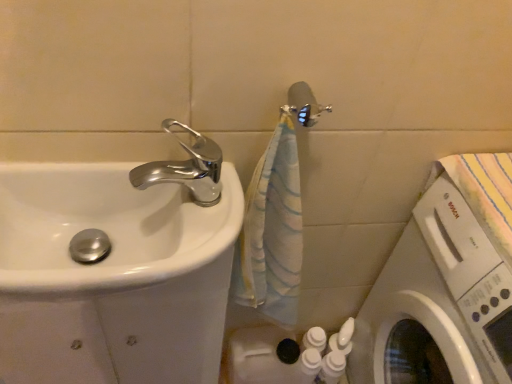
At what (x,y) coordinates should I click in order to perform the action: click on white glossy washing machine at lower right. Please return your answer as a coordinate pair (x, y). This screenshot has height=384, width=512. Looking at the image, I should click on (437, 302).

Where is `chrome metallic faucet at upper left`? The width and height of the screenshot is (512, 384). chrome metallic faucet at upper left is located at coordinates (186, 168).

This screenshot has width=512, height=384. What are the coordinates of `metallic silver shower head at upper center` in the screenshot? It's located at (304, 104).

What is the approximate height of metallic silver shower head at upper center?

2.43 inches.

Measure the distance between white glossy sink at left and camera.

white glossy sink at left is 54.78 centimeters away from camera.

Locate an element on the screen. white glossy washing machine at lower right is located at coordinates (437, 302).

Visually, is chrome metallic faucet at upper left positioned to the left or to the right of white glossy washing machine at lower right?

In the image, chrome metallic faucet at upper left appears on the left side of white glossy washing machine at lower right.

Based on the photo, can white glossy washing machine at lower right be found inside chrome metallic faucet at upper left?

No.

From a real-world perspective, is chrome metallic faucet at upper left below white glossy washing machine at lower right?

No, from a real-world perspective, chrome metallic faucet at upper left is not beneath white glossy washing machine at lower right.

Locate an element on the screen. tap located on the left of white glossy washing machine at lower right is located at coordinates (186, 168).

Considering the relative positions of metallic silver shower head at upper center and white glossy washing machine at lower right in the image provided, is metallic silver shower head at upper center to the right of white glossy washing machine at lower right from the viewer's perspective?

No.

Could you tell me if metallic silver shower head at upper center is turned towards white glossy washing machine at lower right?

No, metallic silver shower head at upper center is not aimed at white glossy washing machine at lower right.

From the image's perspective, is metallic silver shower head at upper center located above white glossy washing machine at lower right?

Indeed, from the image's perspective, metallic silver shower head at upper center is shown above white glossy washing machine at lower right.

Image resolution: width=512 pixels, height=384 pixels. Identify the location of washing machine lying on the right of metallic silver shower head at upper center. (437, 302).

Is metallic silver shower head at upper center at the back of chrome metallic faucet at upper left?

No, chrome metallic faucet at upper left is not facing the opposite direction of metallic silver shower head at upper center.

Is chrome metallic faucet at upper left to the right of metallic silver shower head at upper center from the viewer's perspective?

In fact, chrome metallic faucet at upper left is to the left of metallic silver shower head at upper center.

Does chrome metallic faucet at upper left have a greater width compared to metallic silver shower head at upper center?

Indeed, chrome metallic faucet at upper left has a greater width compared to metallic silver shower head at upper center.

Which is less distant, (449, 184) or (170, 162)?

Positioned in front is point (170, 162).

Is white glossy washing machine at lower right surrounding chrome metallic faucet at upper left?

No.

Is the depth of white glossy washing machine at lower right less than that of chrome metallic faucet at upper left?

Yes, the depth of white glossy washing machine at lower right is less than that of chrome metallic faucet at upper left.

What's the angular difference between white glossy washing machine at lower right and chrome metallic faucet at upper left's facing directions?

They differ by 90.7 degrees in their facing directions.

Which is correct: white glossy sink at left is inside metallic silver shower head at upper center, or outside of it?

white glossy sink at left cannot be found inside metallic silver shower head at upper center.

Is white glossy sink at left next to metallic silver shower head at upper center and touching it?

There is a gap between white glossy sink at left and metallic silver shower head at upper center.

Based on the photo, considering their positions, is white glossy sink at left located in front of or behind metallic silver shower head at upper center?

Clearly, white glossy sink at left is in front of metallic silver shower head at upper center.

From the image's perspective, which object appears higher, white glossy sink at left or metallic silver shower head at upper center?

metallic silver shower head at upper center, from the image's perspective.

From a real-world perspective, between white glossy washing machine at lower right and white glossy sink at left, who is vertically higher?

In real-world perspective, white glossy washing machine at lower right is above.

Is white glossy sink at left surrounded by white glossy washing machine at lower right?

No, white glossy sink at left is not a part of white glossy washing machine at lower right.

Considering the relative sizes of white glossy washing machine at lower right and white glossy sink at left in the image provided, is white glossy washing machine at lower right bigger than white glossy sink at left?

Yes, white glossy washing machine at lower right is bigger than white glossy sink at left.

Relative to white glossy washing machine at lower right, is white glossy sink at left in front or behind?

Clearly, white glossy sink at left is behind white glossy washing machine at lower right.

Is point (45, 205) closer or farther from the camera than point (452, 284)?

Point (45, 205) appears to be closer to the viewer than point (452, 284).

Consider the image. Can you confirm if white glossy sink at left is shorter than white glossy washing machine at lower right?

Yes, white glossy sink at left is shorter than white glossy washing machine at lower right.

Is white glossy sink at left at the left side of white glossy washing machine at lower right?

Correct, you'll find white glossy sink at left to the left of white glossy washing machine at lower right.

This screenshot has height=384, width=512. I want to click on washing machine on the right side of chrome metallic faucet at upper left, so click(x=437, y=302).

I want to click on shower behind the white glossy washing machine at lower right, so click(x=304, y=104).

Estimate the real-world distances between objects in this image. Which object is further from white glossy washing machine at lower right, metallic silver shower head at upper center or white glossy sink at left?

The object further to white glossy washing machine at lower right is white glossy sink at left.

From the image, which object appears to be farther from metallic silver shower head at upper center, white glossy washing machine at lower right or white glossy sink at left?

white glossy washing machine at lower right is further to metallic silver shower head at upper center.

Which object lies further to the anchor point chrome metallic faucet at upper left, metallic silver shower head at upper center or white glossy sink at left?

The object further to chrome metallic faucet at upper left is white glossy sink at left.

Based on their spatial positions, is white glossy sink at left or chrome metallic faucet at upper left further from metallic silver shower head at upper center?

white glossy sink at left is positioned further to the anchor metallic silver shower head at upper center.

Based on their spatial positions, is white glossy washing machine at lower right or metallic silver shower head at upper center closer to white glossy sink at left?

metallic silver shower head at upper center is positioned closer to the anchor white glossy sink at left.

Based on their spatial positions, is chrome metallic faucet at upper left or metallic silver shower head at upper center closer to white glossy washing machine at lower right?

metallic silver shower head at upper center lies closer to white glossy washing machine at lower right than the other object.

Based on their spatial positions, is metallic silver shower head at upper center or white glossy washing machine at lower right further from chrome metallic faucet at upper left?

white glossy washing machine at lower right.

When comparing their distances from metallic silver shower head at upper center, does white glossy washing machine at lower right or chrome metallic faucet at upper left seem further?

white glossy washing machine at lower right lies further to metallic silver shower head at upper center than the other object.

Where is `shower situated between white glossy sink at left and white glossy washing machine at lower right from left to right`? This screenshot has width=512, height=384. shower situated between white glossy sink at left and white glossy washing machine at lower right from left to right is located at coordinates (304, 104).

Locate an element on the screen. tap that lies between metallic silver shower head at upper center and white glossy sink at left from top to bottom is located at coordinates (186, 168).

This screenshot has width=512, height=384. I want to click on shower located between chrome metallic faucet at upper left and white glossy washing machine at lower right in the left-right direction, so click(304, 104).

Image resolution: width=512 pixels, height=384 pixels. What are the coordinates of `tap located between white glossy sink at left and white glossy washing machine at lower right in the left-right direction` in the screenshot? It's located at (186, 168).